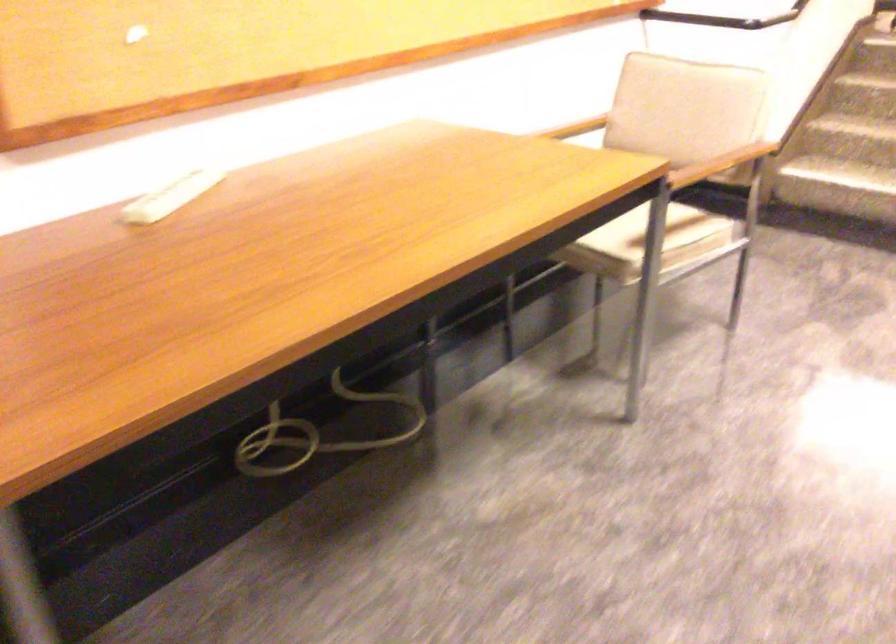
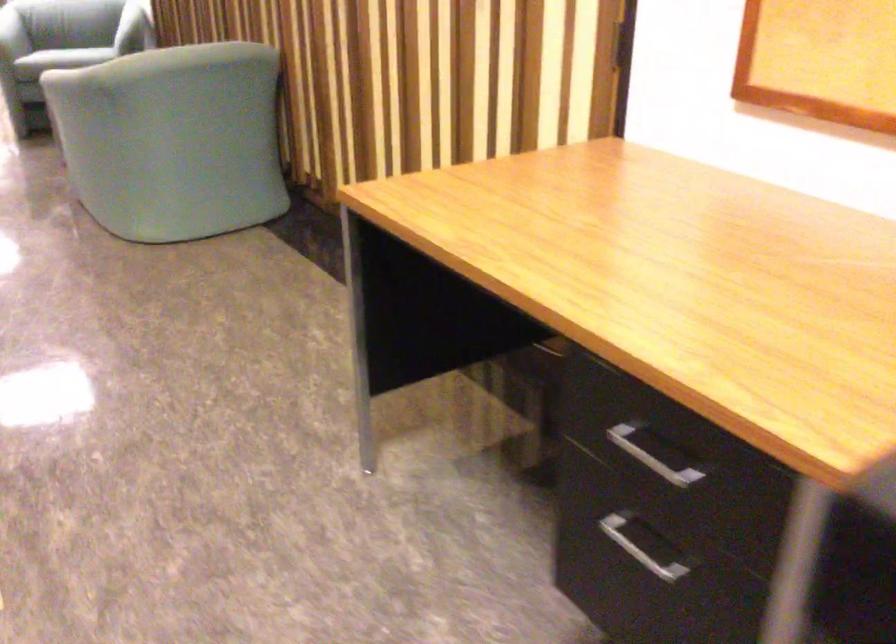
The first image is from the beginning of the video and the second image is from the end. How did the camera likely rotate when shooting the video?

The camera rotated toward left-down.